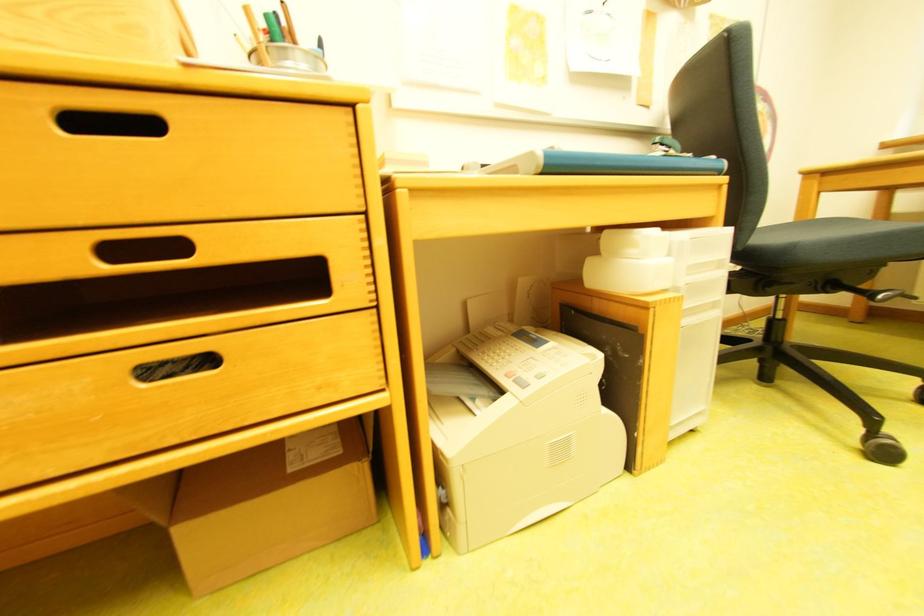
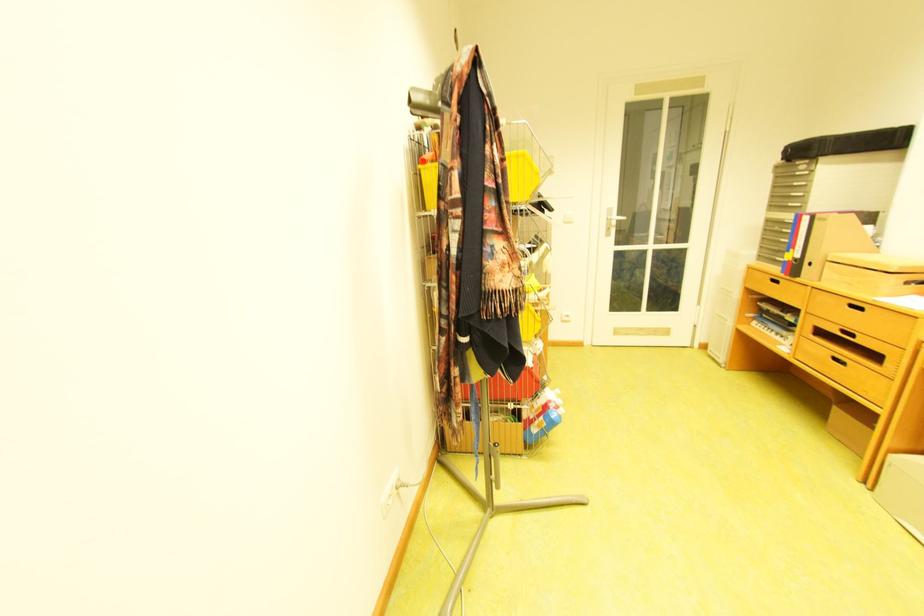
Locate, in the second image, the point that corresponds to (124,254) in the first image.

(855, 333)